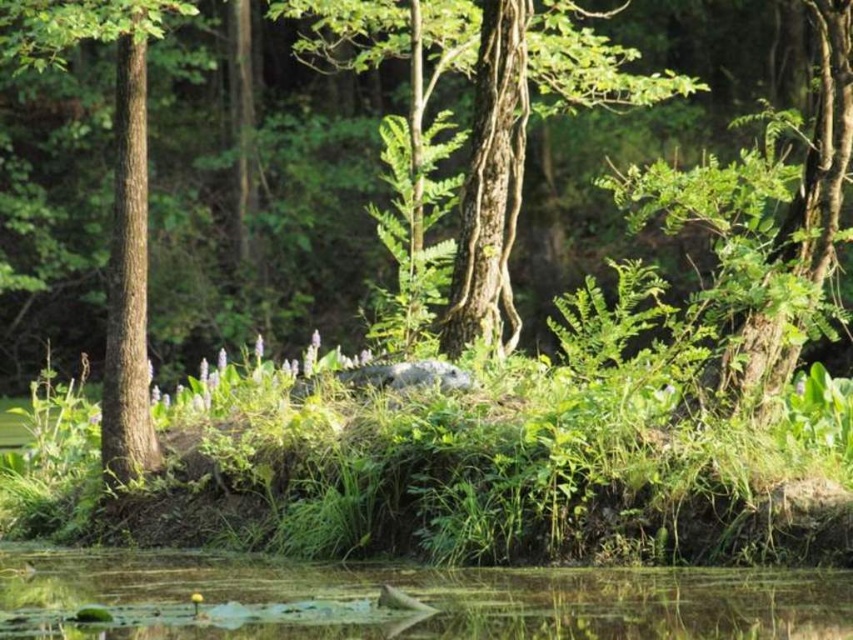
You are standing in the wetland scene. You see the greenish murky water at lower center and the brown rough bark tree at left. Which object is positioned to the right of the other?

The greenish murky water at lower center is positioned to the right of the brown rough bark tree at left.

Based on the photo, you are a photographer trying to capture the entire scene in one shot. Given that your camera can only focus on objects larger than a certain size, which object between the greenish murky water at lower center and the brown rough bark tree at left will definitely be in focus?

The greenish murky water at lower center will definitely be in focus because it is bigger than the brown rough bark tree at left, and the camera can focus on objects larger than a certain size.